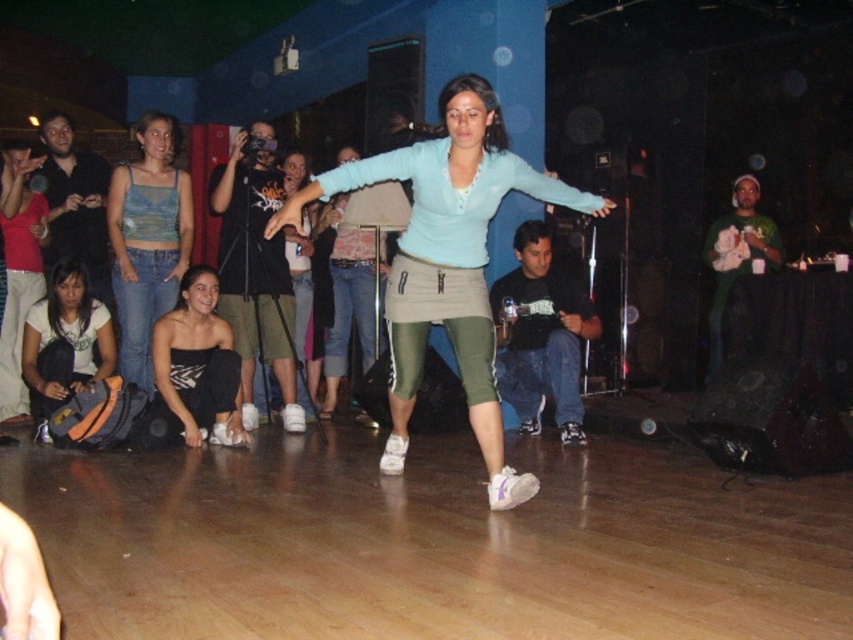
Between matte blue sweater at center and matte black tank top at lower left, which one has less height?

matte black tank top at lower left is shorter.

Is matte blue sweater at center below matte black tank top at lower left?

Actually, matte blue sweater at center is above matte black tank top at lower left.

Between point (299, 212) and point (42, 330), which one is positioned in front?

Point (299, 212) is in front.

Where is `matte blue sweater at center`? The width and height of the screenshot is (853, 640). matte blue sweater at center is located at coordinates (448, 260).

Who is more distant from viewer, (39,381) or (291,150)?

Positioned behind is point (291,150).

In the scene shown: Does matte black tank top at lower left have a greater height compared to matte black tank top at center?

No, matte black tank top at lower left is not taller than matte black tank top at center.

Describe the element at coordinates (65, 342) in the screenshot. The image size is (853, 640). I see `matte black tank top at lower left` at that location.

Locate an element on the screen. The image size is (853, 640). matte black tank top at lower left is located at coordinates (65, 342).

Find the location of a particular element. light blue denim tank top at lower left is located at coordinates (148, 241).

Is light blue denim tank top at lower left positioned before matte black tank top at center?

Yes, it is in front of matte black tank top at center.

Where is `light blue denim tank top at lower left`? This screenshot has height=640, width=853. light blue denim tank top at lower left is located at coordinates (148, 241).

This screenshot has height=640, width=853. Find the location of `light blue denim tank top at lower left`. light blue denim tank top at lower left is located at coordinates (148, 241).